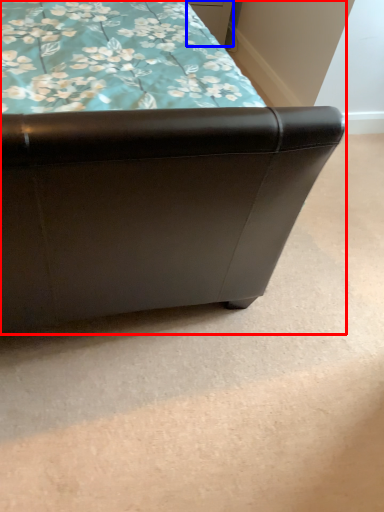
Question: Which of the following is the closest to the observer, furniture (highlighted by a red box) or drawer (highlighted by a blue box)?

Choices:
 (A) furniture
 (B) drawer

Answer: (A)